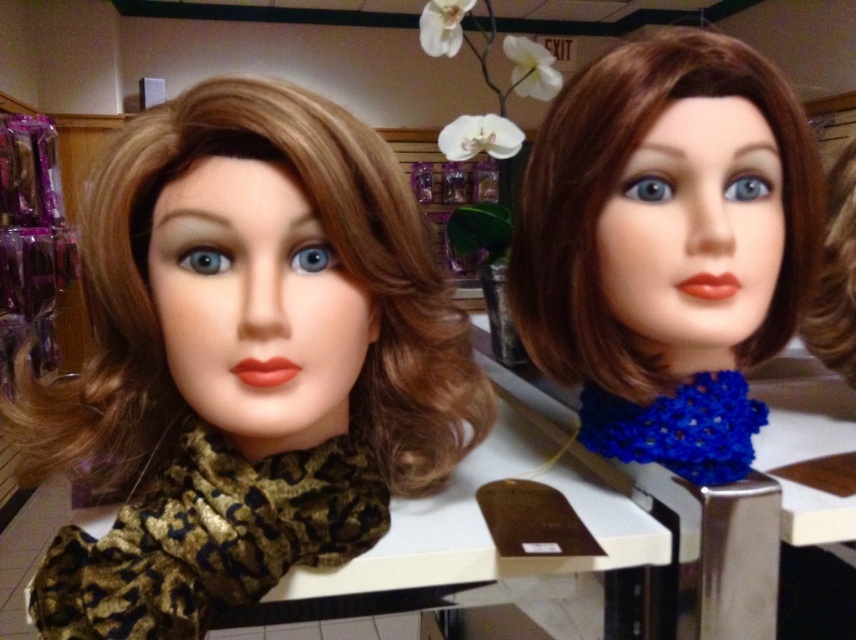
You are a customer in a beauty supply store looking at two mannequin heads displayed on a shelf. You notice two points marked on the mannequins. The first point is at coordinate point (x=786, y=157) and the second point is at coordinate point (x=833, y=268). Which point is closer to you, the customer, when observing the display?

Point (x=786, y=157) is in front of point (x=833, y=268), so the first point is closer to you.

You are a customer in a beauty store looking for a table to place your new hair accessories. You see the metallic silver table at center and the brown silky hair at upper right. Which one is a suitable surface to place your items on?

The metallic silver table at center is a suitable surface to place your items on because it is bigger than the brown silky hair at upper right and likely provides enough space for your accessories.

You are a customer in a store looking to place both the metallic silver table at center and the brown silky hair at upper right on a shelf. The shelf has a width of 1.2 meters. Can both items fit side by side on the shelf without overlapping?

The metallic silver table at center might be wider than brown silky hair at upper right. Since the shelf is 1.2 meters wide, it is uncertain if both items can fit side by side without overlapping because the exact widths are not provided.